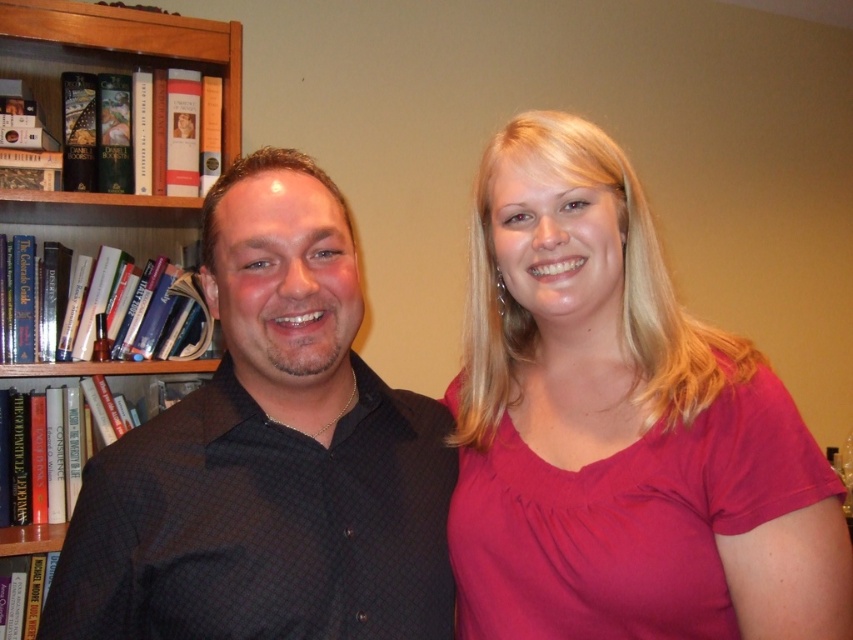
You are organizing a clothing donation drive and need to determine if the pink fabric shirt at right and the black dotted shirt at left can fit side by side in a storage box that is 1 meter wide. Based on their widths, will they fit?

The pink fabric shirt at right has a lesser width compared to black dotted shirt at left. If the combined width of both shirts is less than or equal to 1 meter, they can fit. However, since the exact widths are not provided, we cannot confirm. But since the pink shirt is narrower, it might be possible if the black dotted shirt is not excessively wide.

You are an interior designer planning to place a new sofa in the room. The sofa is 1.5 meters wide. You see the pink fabric shirt at right and the wooden bookcase at left. Which object can the sofa fit next to without overlapping, considering their widths?

The sofa is 1.5 meters wide. The pink fabric shirt at right has a lesser width compared to wooden bookcase at left, so the sofa can fit next to the wooden bookcase at left since it is wider than the shirt.